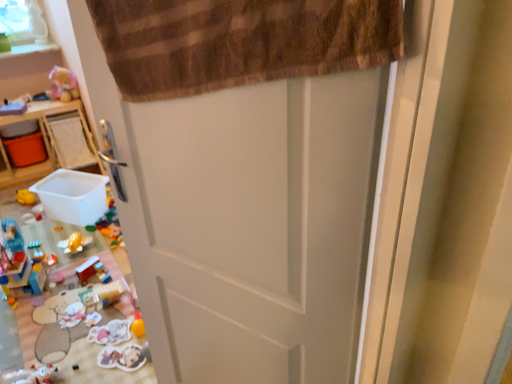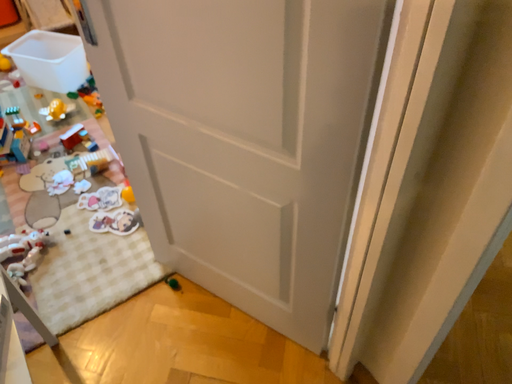
Question: Which way did the camera rotate in the video?

Choices:
 (A) rotated downward
 (B) rotated upward

Answer: (A)